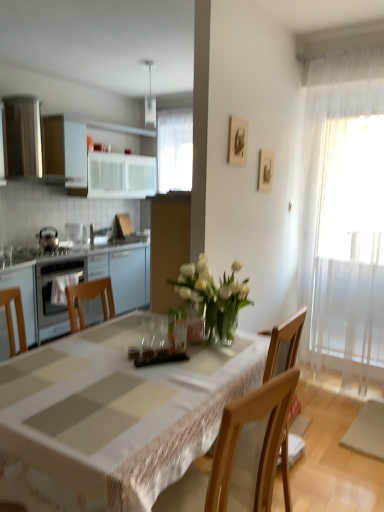
Question: Is satin silver oven at left at the left side of wooden picture frame at upper center, placed as the second picture frame when sorted from back to front?

Choices:
 (A) no
 (B) yes

Answer: (B)

Question: Considering the relative sizes of satin silver oven at left and wooden picture frame at upper center, the 1th picture frame viewed from the front, in the image provided, is satin silver oven at left smaller than wooden picture frame at upper center, the 1th picture frame viewed from the front,?

Choices:
 (A) yes
 (B) no

Answer: (B)

Question: Can you confirm if satin silver oven at left is bigger than wooden picture frame at upper center, the 1th picture frame viewed from the front?

Choices:
 (A) no
 (B) yes

Answer: (B)

Question: Is satin silver oven at left taller than wooden picture frame at upper center, placed as the second picture frame when sorted from back to front?

Choices:
 (A) yes
 (B) no

Answer: (B)

Question: Does satin silver oven at left appear on the right side of wooden picture frame at upper center, positioned as the 1th picture frame in left-to-right order?

Choices:
 (A) yes
 (B) no

Answer: (B)

Question: Considering the positions of point (203, 409) and point (46, 251), is point (203, 409) closer or farther from the camera than point (46, 251)?

Choices:
 (A) closer
 (B) farther

Answer: (A)

Question: Which is correct: white clothed table at center is inside satin silver gas stove at left, or outside of it?

Choices:
 (A) inside
 (B) outside

Answer: (B)

Question: From a real-world perspective, relative to satin silver gas stove at left, is white clothed table at center vertically above or below?

Choices:
 (A) below
 (B) above

Answer: (A)

Question: In the image, is white clothed table at center on the left side or the right side of satin silver gas stove at left?

Choices:
 (A) left
 (B) right

Answer: (B)

Question: Based on their positions, is matte white cabinets at left, placed as the 2th cabinetry when sorted from top to bottom, located to the left or right of white clothed table at center?

Choices:
 (A) right
 (B) left

Answer: (B)

Question: From a real-world perspective, is matte white cabinets at left, the first cabinetry positioned from the bottom, above or below white clothed table at center?

Choices:
 (A) below
 (B) above

Answer: (B)

Question: Considering their positions, is matte white cabinets at left, placed as the 2th cabinetry when sorted from top to bottom, located in front of or behind white clothed table at center?

Choices:
 (A) behind
 (B) front

Answer: (A)

Question: Considering the positions of matte white cabinets at left, the first cabinetry positioned from the bottom, and white clothed table at center in the image, is matte white cabinets at left, the first cabinetry positioned from the bottom, wider or thinner than white clothed table at center?

Choices:
 (A) thin
 (B) wide

Answer: (A)

Question: Relative to white glossy cabinets at upper left, the 2th cabinetry positioned from the bottom, is matte white cabinets at left, the first cabinetry positioned from the bottom, in front or behind?

Choices:
 (A) front
 (B) behind

Answer: (A)

Question: Considering the positions of matte white cabinets at left, placed as the 2th cabinetry when sorted from top to bottom, and white glossy cabinets at upper left, the 1th cabinetry in the top-to-bottom sequence, in the image, is matte white cabinets at left, placed as the 2th cabinetry when sorted from top to bottom, wider or thinner than white glossy cabinets at upper left, the 1th cabinetry in the top-to-bottom sequence,?

Choices:
 (A) wide
 (B) thin

Answer: (A)